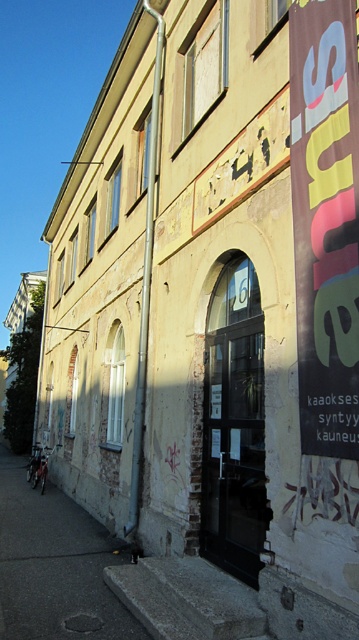
Does yellow fabric banner at right have a lesser height compared to dark concrete alley at lower left?

Incorrect, yellow fabric banner at right's height does not fall short of dark concrete alley at lower left's.

Find the location of a particular element. yellow fabric banner at right is located at coordinates (325, 221).

This screenshot has width=359, height=640. I want to click on yellow fabric banner at right, so click(325, 221).